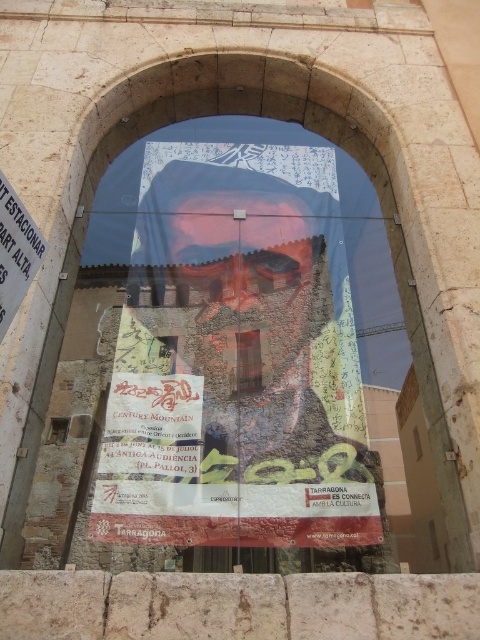
You are a delivery person trying to hang a new poster on the wall. You have a matte blue poster at center and a matte paper poster at center. According to the scene, which one do you think is wider so that it can cover more of the window?

The matte blue poster at center might be wider than matte paper poster at center, so the matte blue poster at center is likely wider and can cover more of the window.

You are standing in front of the arched window and see two points marked on the poster. The first point is at coordinates point (x=205, y=314) and the second is at point (x=3, y=177). If you want to touch the closer point to you, which coordinate should you aim for?

Point (x=205, y=314) is further to the viewer than point (x=3, y=177), so the closer point to you is point (x=3, y=177). You should aim for point (x=3, y=177).